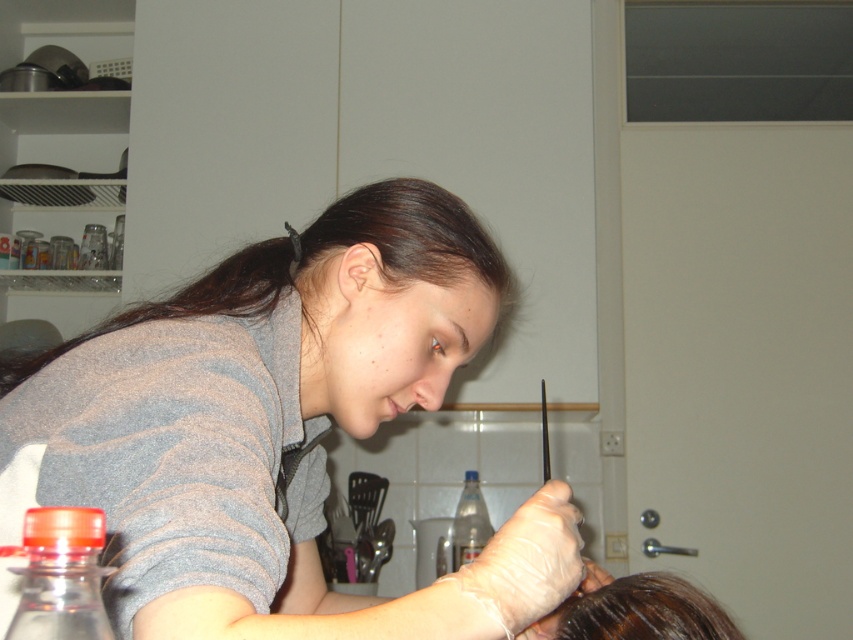
You are standing in the kitchen scene and want to reach both points mentioned. Which point, point (61, 572) or point (463, 497), will you reach first?

Point (61, 572) is closer to the viewer than point (463, 497), so you will reach point (61, 572) first.

You are a person who needs to reach for a bottle in the kitchen. You see a transparent plastic bottle at lower left and a translucent plastic bottle at center. Which bottle is located above the other?

The transparent plastic bottle at lower left is positioned over the translucent plastic bottle at center.

In the scene shown: You are organizing a small kitchen storage area and need to decide where to place the gray matte shirt at upper left and the transparent plastic bottle at lower left. Since the shelf space is limited, which object should you prioritize placing first based on their sizes?

The gray matte shirt at upper left has a larger size compared to the transparent plastic bottle at lower left, so you should prioritize placing the gray matte shirt at upper left first to accommodate its larger size before the smaller bottle.